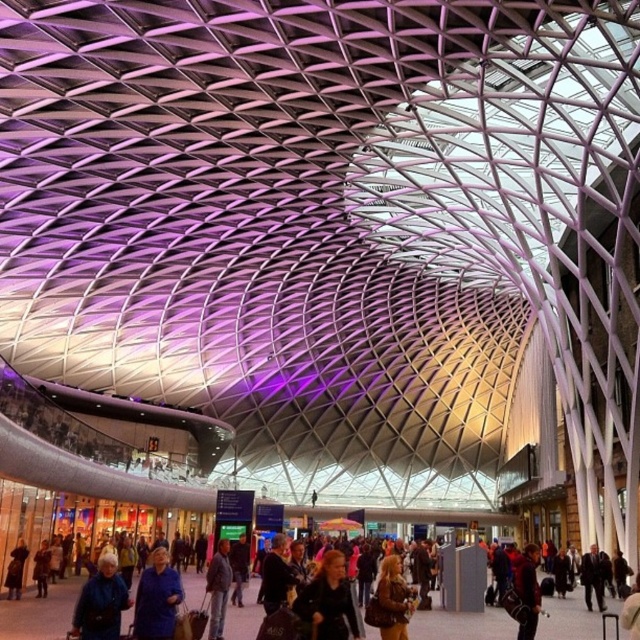
You are a photographer trying to capture both the red leather jacket at lower right and the light brown leather jacket at center in a single frame. Considering their heights, which jacket will appear smaller in the photo?

The red leather jacket at lower right has a lesser height compared to the light brown leather jacket at center, so it will appear smaller in the photo.